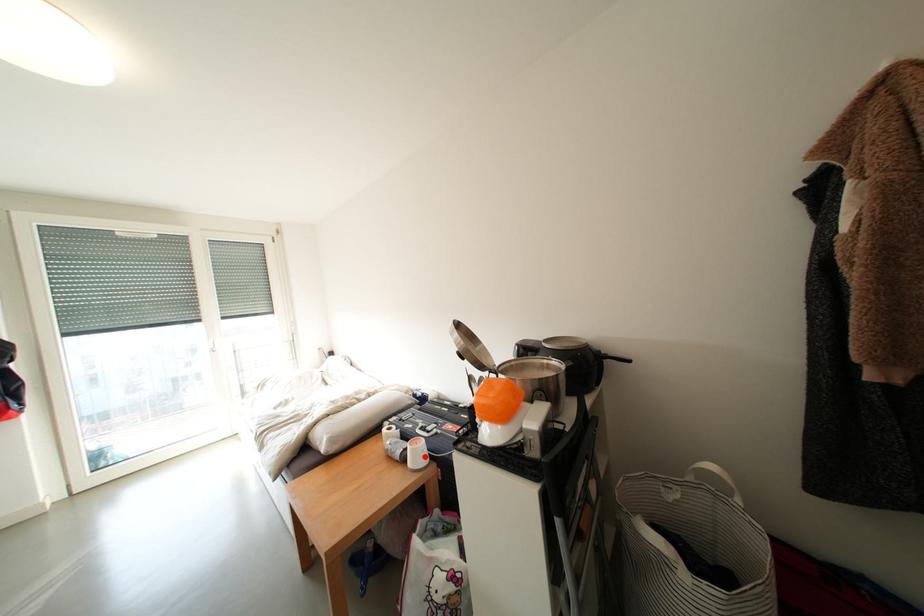
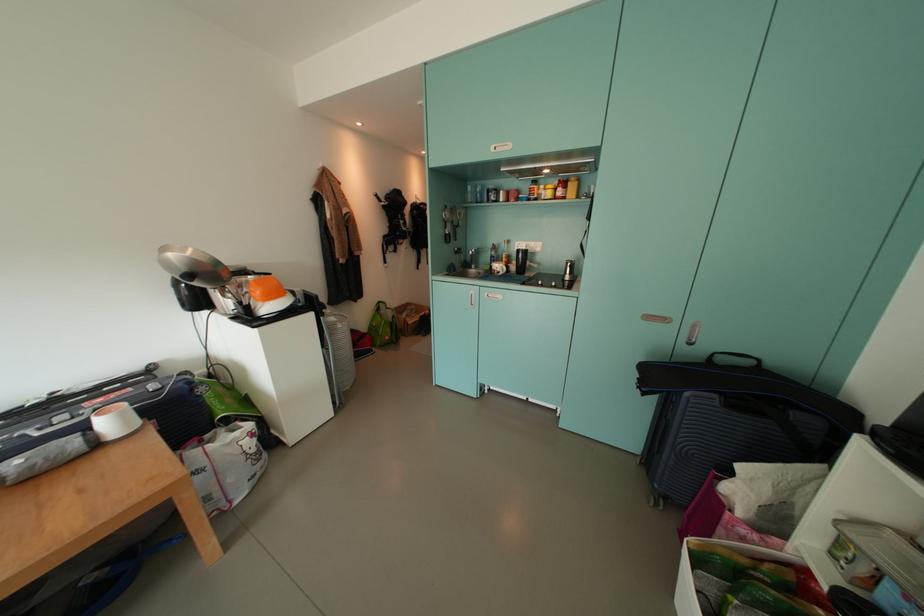
Where in the second image is the point corresponding to the highlighted location from the first image?

(123, 426)